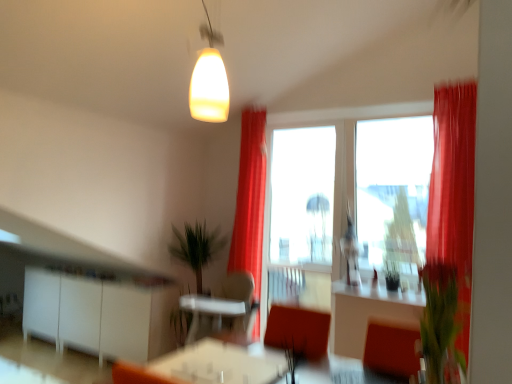
Question: From the image's perspective, is matte orange table at center over green leafy plant at right, which is the 1th plant from top to bottom?

Choices:
 (A) no
 (B) yes

Answer: (A)

Question: Can you confirm if matte orange table at center is smaller than green leafy plant at right, the second plant when ordered from bottom to top?

Choices:
 (A) yes
 (B) no

Answer: (B)

Question: Is matte orange table at center not inside green leafy plant at right, which is the 1th plant from top to bottom?

Choices:
 (A) no
 (B) yes

Answer: (B)

Question: From a real-world perspective, is matte orange table at center located higher than green leafy plant at right, which is the 2th plant in back-to-front order?

Choices:
 (A) no
 (B) yes

Answer: (A)

Question: Are matte orange table at center and green leafy plant at right, which appears as the second plant when viewed from the left, far apart?

Choices:
 (A) yes
 (B) no

Answer: (A)

Question: Can you confirm if matte orange table at center is taller than green leafy plant at right, which is the 1th plant from top to bottom?

Choices:
 (A) yes
 (B) no

Answer: (B)

Question: From a real-world perspective, is white glossy counter top at center on green leafy plant at right, which is the 2th plant in back-to-front order?

Choices:
 (A) no
 (B) yes

Answer: (A)

Question: Is white glossy counter top at center not near green leafy plant at right, which is the 1th plant from top to bottom?

Choices:
 (A) yes
 (B) no

Answer: (A)

Question: From the image's perspective, is white glossy counter top at center beneath green leafy plant at right, which is the 2th plant in back-to-front order?

Choices:
 (A) yes
 (B) no

Answer: (A)

Question: Does white glossy counter top at center lie in front of green leafy plant at right, which is the 2th plant in back-to-front order?

Choices:
 (A) yes
 (B) no

Answer: (B)

Question: From the image's perspective, is white glossy counter top at center on top of green leafy plant at right, which is the 2th plant in back-to-front order?

Choices:
 (A) no
 (B) yes

Answer: (A)

Question: Does white glossy counter top at center turn towards green leafy plant at right, marked as the 1th plant in a front-to-back arrangement?

Choices:
 (A) no
 (B) yes

Answer: (A)

Question: Can you confirm if silky red curtain at right, positioned as the first curtain in front-to-back order, is positioned to the left of matte glass pendant at upper center?

Choices:
 (A) yes
 (B) no

Answer: (B)